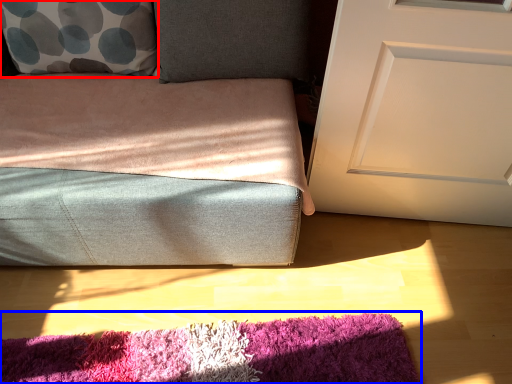
Question: Which object is closer to the camera taking this photo, throw pillow (highlighted by a red box) or mat (highlighted by a blue box)?

Choices:
 (A) throw pillow
 (B) mat

Answer: (B)